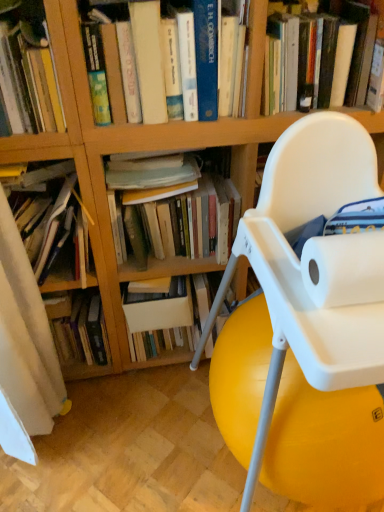
Measure the distance between hardcover book at upper left, which is the 3th book in left-to-right order, and camera.

hardcover book at upper left, which is the 3th book in left-to-right order, is 85.20 centimeters from camera.

Locate an element on the screen. hardcover book at upper center, which is counted as the fourth book, starting from the left is located at coordinates (210, 61).

I want to click on hardcover book at left, which ranks as the 2th book in left-to-right order, so click(x=81, y=330).

What is the approximate width of hardcover book at upper center, the sixth book from the left?

It is 12.75 inches.

At what (x,y) coordinates should I click in order to perform the action: click on hardcover book at upper center, the sixth book from the left. Please return your answer as a coordinate pair (x, y). Looking at the image, I should click on (321, 58).

Identify the location of hardcover book at upper left, the 4th book from the right. Image resolution: width=384 pixels, height=512 pixels. 29,70.

Is hardcover book at upper left, the 4th book from the right, not inside hardcover books at left, the 1th book positioned from the left?

Yes, hardcover book at upper left, the 4th book from the right, is not within hardcover books at left, the 1th book positioned from the left.

Where is `the 2nd book counting from the right side of the hardcover books at left, the 1th book positioned from the left`? The image size is (384, 512). the 2nd book counting from the right side of the hardcover books at left, the 1th book positioned from the left is located at coordinates (29, 70).

From the image's perspective, is hardcover book at upper left, which is the 3th book in left-to-right order, on hardcover books at left, the 1th book positioned from the left?

Yes.

In the image, is white plastic chair at center on the left side or the right side of hardcover book at upper center, positioned as the third book in right-to-left order?

white plastic chair at center is to the right of hardcover book at upper center, positioned as the third book in right-to-left order.

Looking at the image, does white plastic chair at center seem bigger or smaller compared to hardcover book at upper center, positioned as the third book in right-to-left order?

white plastic chair at center is bigger than hardcover book at upper center, positioned as the third book in right-to-left order.

Are white plastic chair at center and hardcover book at upper center, which is counted as the fourth book, starting from the left, beside each other?

white plastic chair at center is not next to hardcover book at upper center, which is counted as the fourth book, starting from the left, and they're not touching.

Is the depth of white plastic chair at center less than that of hardcover book at upper center, positioned as the third book in right-to-left order?

Yes, it is in front of hardcover book at upper center, positioned as the third book in right-to-left order.

This screenshot has width=384, height=512. In order to click on the 4th book above when counting from the hardcover books at left, placed as the 6th book when sorted from right to left (from the image's perspective) in this screenshot , I will do `click(321, 58)`.

In terms of width, does hardcover book at upper center, which appears as the 1th book when viewed from the right, look wider or thinner when compared to hardcover books at left, placed as the 6th book when sorted from right to left?

Clearly, hardcover book at upper center, which appears as the 1th book when viewed from the right, has less width compared to hardcover books at left, placed as the 6th book when sorted from right to left.

From the picture: In the image, is hardcover book at upper center, which appears as the 1th book when viewed from the right, positioned in front of or behind hardcover books at left, the 1th book positioned from the left?

Visually, hardcover book at upper center, which appears as the 1th book when viewed from the right, is located in front of hardcover books at left, the 1th book positioned from the left.

Is point (105, 362) positioned before point (231, 359)?

No.

From the image's perspective, is hardcover book at left, which appears as the 5th book when viewed from the right, located above or below white plastic chair at center?

Clearly, from the image's perspective, hardcover book at left, which appears as the 5th book when viewed from the right, is below white plastic chair at center.

From a real-world perspective, is hardcover book at left, which appears as the 5th book when viewed from the right, above or below white plastic chair at center?

hardcover book at left, which appears as the 5th book when viewed from the right, is below white plastic chair at center.

Is point (199, 198) positioned after point (356, 9)?

Yes, it is behind point (356, 9).

Is hardcover books at center, acting as the 2th book starting from the right, aimed at hardcover book at upper center, which appears as the 1th book when viewed from the right?

No, hardcover books at center, acting as the 2th book starting from the right, is not turned towards hardcover book at upper center, which appears as the 1th book when viewed from the right.

Which is behind, hardcover books at center, marked as the 5th book in a left-to-right arrangement, or hardcover book at upper center, which appears as the 1th book when viewed from the right?

hardcover books at center, marked as the 5th book in a left-to-right arrangement.

Does hardcover books at center, marked as the 5th book in a left-to-right arrangement, have a lesser width compared to hardcover book at upper center, the sixth book from the left?

Indeed, hardcover books at center, marked as the 5th book in a left-to-right arrangement, has a lesser width compared to hardcover book at upper center, the sixth book from the left.

Is hardcover books at center, marked as the 5th book in a left-to-right arrangement, next to hardcover book at left, which appears as the 5th book when viewed from the right?

No, hardcover books at center, marked as the 5th book in a left-to-right arrangement, is not making contact with hardcover book at left, which appears as the 5th book when viewed from the right.

Which point is more forward, (137,168) or (81,307)?

The point (137,168) is more forward.

Consider the image. From the image's perspective, which one is positioned higher, hardcover books at center, marked as the 5th book in a left-to-right arrangement, or hardcover book at left, which appears as the 5th book when viewed from the right?

hardcover books at center, marked as the 5th book in a left-to-right arrangement.

Is hardcover books at center, marked as the 5th book in a left-to-right arrangement, positioned with its back to hardcover book at left, which appears as the 5th book when viewed from the right?

No, hardcover book at left, which appears as the 5th book when viewed from the right, is not at the back of hardcover books at center, marked as the 5th book in a left-to-right arrangement.

Considering the relative positions of hardcover book at upper center, positioned as the third book in right-to-left order, and hardcover books at left, placed as the 6th book when sorted from right to left, in the image provided, is hardcover book at upper center, positioned as the third book in right-to-left order, behind hardcover books at left, placed as the 6th book when sorted from right to left,?

No, it is not.

Where is `book that is the 2nd one below the hardcover book at upper center, positioned as the third book in right-to-left order (from a real-world perspective)`? book that is the 2nd one below the hardcover book at upper center, positioned as the third book in right-to-left order (from a real-world perspective) is located at coordinates (52, 213).

Is hardcover book at upper center, positioned as the third book in right-to-left order, not within hardcover books at left, the 1th book positioned from the left?

Yes, hardcover book at upper center, positioned as the third book in right-to-left order, is outside of hardcover books at left, the 1th book positioned from the left.

Is hardcover book at upper center, positioned as the third book in right-to-left order, aimed at hardcover books at left, placed as the 6th book when sorted from right to left?

No, hardcover book at upper center, positioned as the third book in right-to-left order, is not oriented towards hardcover books at left, placed as the 6th book when sorted from right to left.

Starting from the hardcover books at left, the 1th book positioned from the left, which book is the 2nd one to the right? Please provide its 2D coordinates.

[(29, 70)]

The height and width of the screenshot is (512, 384). I want to click on the 3rd book to the left of the white plastic chair at center, starting your count from the anchor, so click(x=210, y=61).

Based on their spatial positions, is hardcover books at left, the 1th book positioned from the left, or hardcover books at center, acting as the 2th book starting from the right, closer to hardcover book at upper center, which is counted as the fourth book, starting from the left?

Based on the image, hardcover books at center, acting as the 2th book starting from the right, appears to be nearer to hardcover book at upper center, which is counted as the fourth book, starting from the left.

Looking at the image, which one is located closer to hardcover book at upper center, which is counted as the fourth book, starting from the left, white plastic chair at center or hardcover books at left, the 1th book positioned from the left?

The object closer to hardcover book at upper center, which is counted as the fourth book, starting from the left, is hardcover books at left, the 1th book positioned from the left.

Looking at the image, which one is located closer to hardcover books at left, the 1th book positioned from the left, hardcover book at upper left, the 4th book from the right, or hardcover book at upper center, which appears as the 1th book when viewed from the right?

hardcover book at upper left, the 4th book from the right.

From the image, which object appears to be nearer to hardcover book at upper center, which is counted as the fourth book, starting from the left, hardcover book at upper center, the sixth book from the left, or white plastic chair at center?

Based on the image, hardcover book at upper center, the sixth book from the left, appears to be nearer to hardcover book at upper center, which is counted as the fourth book, starting from the left.

Estimate the real-world distances between objects in this image. Which object is further from hardcover books at left, placed as the 6th book when sorted from right to left, hardcover book at upper center, which appears as the 1th book when viewed from the right, or hardcover book at upper center, positioned as the third book in right-to-left order?

hardcover book at upper center, which appears as the 1th book when viewed from the right, lies further to hardcover books at left, placed as the 6th book when sorted from right to left, than the other object.

From the picture: When comparing their distances from hardcover books at left, the 1th book positioned from the left, does hardcover book at left, which appears as the 5th book when viewed from the right, or hardcover book at upper center, which appears as the 1th book when viewed from the right, seem closer?

hardcover book at left, which appears as the 5th book when viewed from the right, is positioned closer to the anchor hardcover books at left, the 1th book positioned from the left.

Which object lies nearer to the anchor point hardcover books at left, placed as the 6th book when sorted from right to left, white plastic chair at center or hardcover book at upper center, which appears as the 1th book when viewed from the right?

white plastic chair at center lies closer to hardcover books at left, placed as the 6th book when sorted from right to left, than the other object.

Which object lies nearer to the anchor point hardcover book at upper center, the sixth book from the left, hardcover book at upper left, which is the 3th book in left-to-right order, or white plastic chair at center?

Based on the image, white plastic chair at center appears to be nearer to hardcover book at upper center, the sixth book from the left.

Identify the location of book between hardcover book at upper center, which is counted as the fourth book, starting from the left, and hardcover book at upper center, the sixth book from the left. This screenshot has height=512, width=384. [177, 207].

This screenshot has height=512, width=384. In order to click on book between hardcover book at upper left, the 4th book from the right, and hardcover books at center, acting as the 2th book starting from the right, from left to right in this screenshot , I will do `click(210, 61)`.